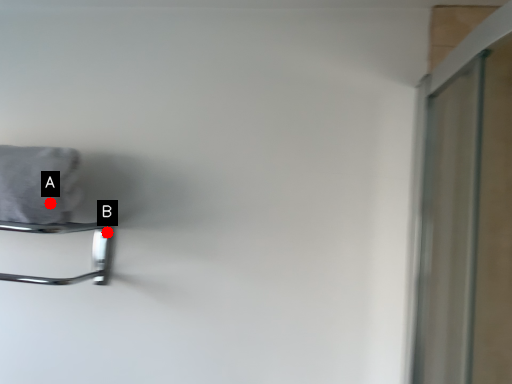
Question: Two points are circled on the image, labeled by A and B beside each circle. Which point appears farthest from the camera in this image?

Choices:
 (A) A is further
 (B) B is further

Answer: (B)